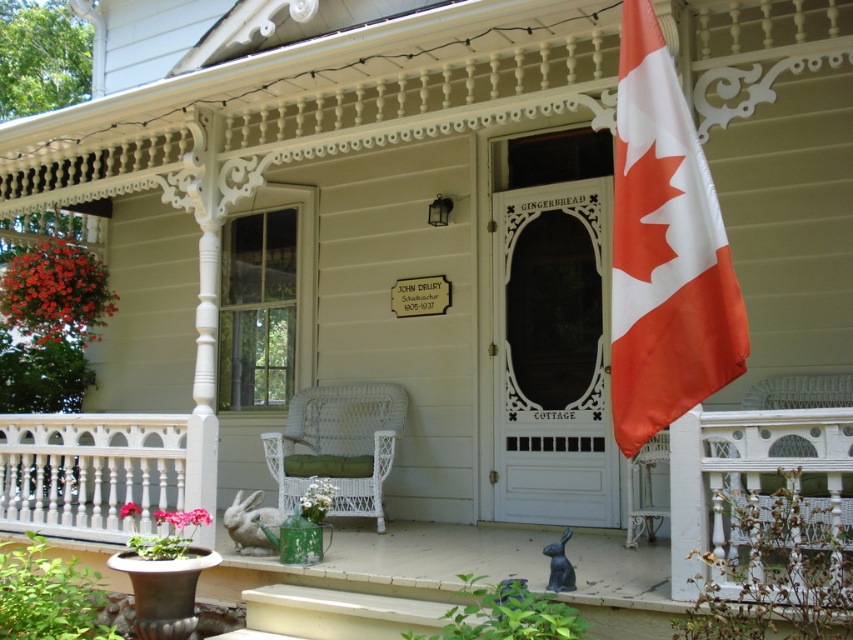
Which is more to the right, white wicker chair at center or white carved wood railing at lower left?

white carved wood railing at lower left

Is point (364, 564) closer to camera compared to point (28, 458)?

Yes, it is in front of point (28, 458).

Does point (811, 467) lie behind point (67, 509)?

No.

Find the location of a particular element. The height and width of the screenshot is (640, 853). white wicker chair at center is located at coordinates (701, 500).

Does point (346, 634) come in front of point (735, 353)?

That is False.

Between white wicker chair at center and red fabric flag at right, which one has more height?

red fabric flag at right

Where is `white wicker chair at center`? The width and height of the screenshot is (853, 640). white wicker chair at center is located at coordinates (701, 500).

Where is `white wicker chair at center`? The image size is (853, 640). white wicker chair at center is located at coordinates (701, 500).

What do you see at coordinates (701, 500) in the screenshot? I see `white wicker chair at center` at bounding box center [701, 500].

Image resolution: width=853 pixels, height=640 pixels. In order to click on white wicker chair at center in this screenshot , I will do `click(701, 500)`.